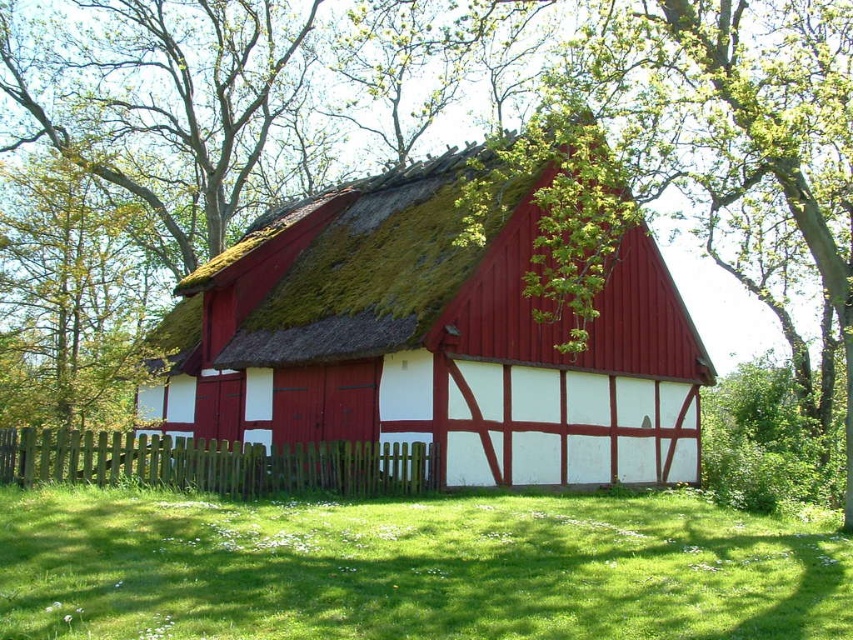
Question: Is matte red wood cottage at center further to the viewer compared to green wooden fence at lower center?

Choices:
 (A) no
 (B) yes

Answer: (B)

Question: Which object is the closest to the green grass at lower center?

Choices:
 (A) matte red wood cottage at center
 (B) green wooden fence at lower center

Answer: (B)

Question: Can you confirm if matte red wood cottage at center is thinner than green wooden fence at lower center?

Choices:
 (A) no
 (B) yes

Answer: (A)

Question: Does matte red wood cottage at center come behind green grass at lower center?

Choices:
 (A) no
 (B) yes

Answer: (B)

Question: Which point appears closest to the camera in this image?

Choices:
 (A) (276, 454)
 (B) (607, 268)
 (C) (619, 605)

Answer: (C)

Question: Which point is farther from the camera taking this photo?

Choices:
 (A) (531, 339)
 (B) (138, 470)

Answer: (A)